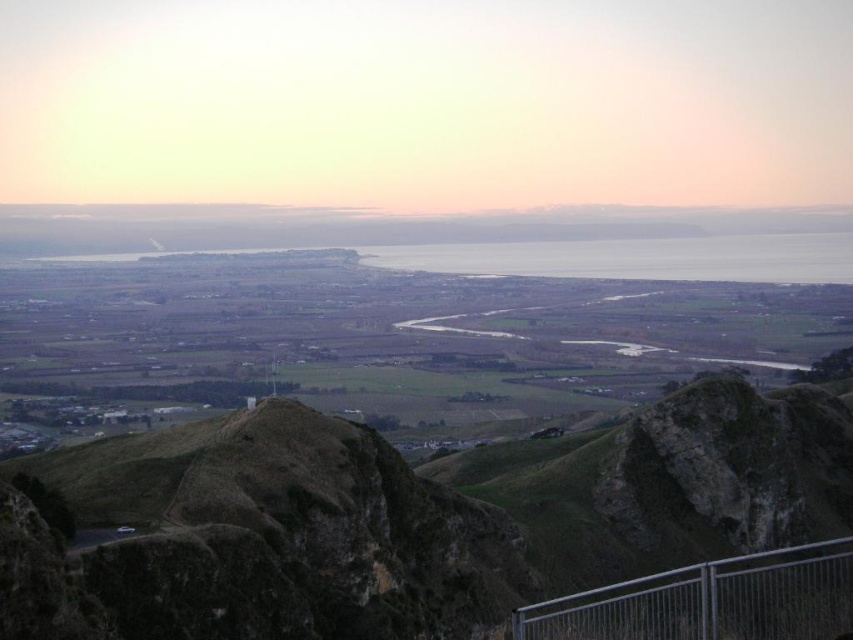
You are a hiker standing at the viewpoint marked by the metallic silver rail at lower right. You want to take a photo of the brown rocky mountain at center. Which object will appear larger in your camera viewfinder?

The brown rocky mountain at center will appear larger in the camera viewfinder because it is bigger than the metallic silver rail at lower right.

You are standing at the viewpoint looking out at the scene. There is a brown rocky mountain at center and a metallic silver rail at lower right. Which object is closer to your current position?

The metallic silver rail at lower right is closer to your current position because it is positioned above the brown rocky mountain at center, which is further away.